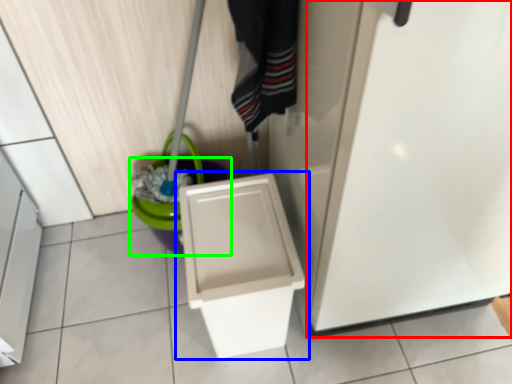
Question: Based on their relative distances, which object is nearer to screen door (highlighted by a red box)? Choose from toilet (highlighted by a blue box) and potty (highlighted by a green box).

Choices:
 (A) toilet
 (B) potty

Answer: (A)